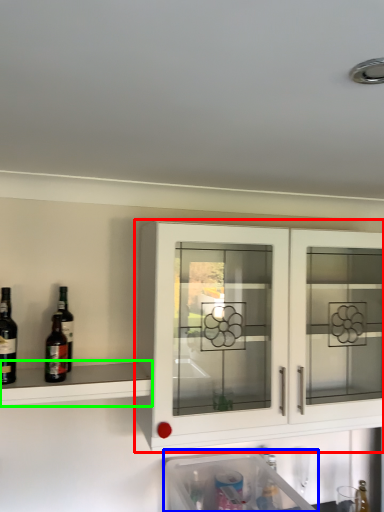
Question: Which object is positioned closest to cabinetry (highlighted by a red box)? Select from dish washer (highlighted by a blue box) and shelf (highlighted by a green box).

Choices:
 (A) dish washer
 (B) shelf

Answer: (B)